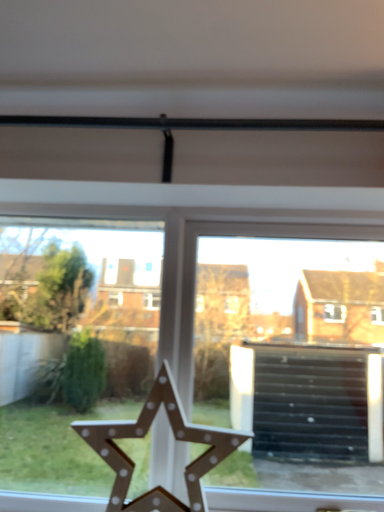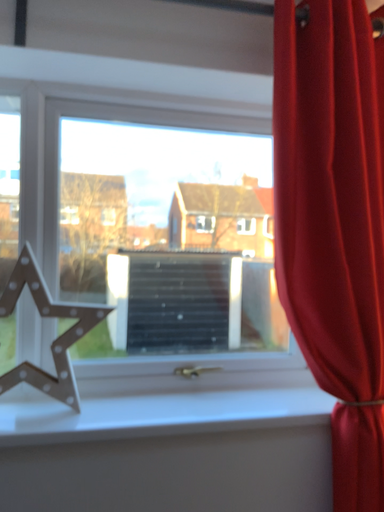
Question: Which way did the camera rotate in the video?

Choices:
 (A) rotated upward
 (B) rotated downward

Answer: (B)